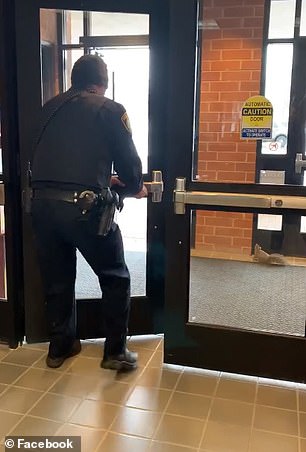
Find the location of a particular element. This screenshot has height=452, width=306. door hinge to the left is located at coordinates (18, 163).